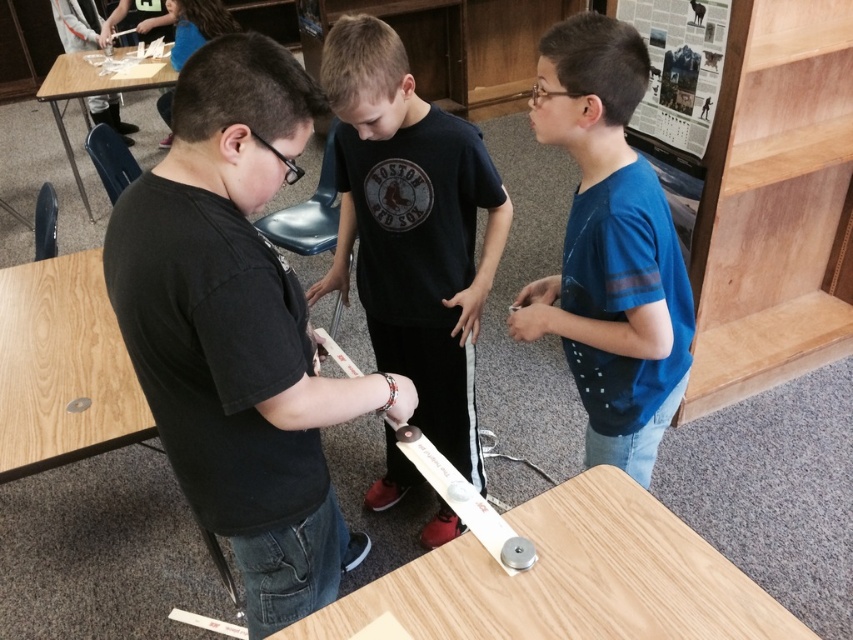
Can you confirm if black cotton shirt at center is positioned below wooden table at upper left?

Indeed, black cotton shirt at center is positioned under wooden table at upper left.

How distant is black cotton shirt at center from wooden table at upper left?

They are 2.69 meters apart.

I want to click on black cotton shirt at center, so click(x=412, y=228).

Who is lower down, blue cotton shirt at center or wooden table at upper left?

Positioned lower is blue cotton shirt at center.

Is blue cotton shirt at center smaller than wooden table at upper left?

Indeed, blue cotton shirt at center has a smaller size compared to wooden table at upper left.

Describe the element at coordinates (608, 248) in the screenshot. The width and height of the screenshot is (853, 640). I see `blue cotton shirt at center` at that location.

The height and width of the screenshot is (640, 853). I want to click on blue cotton shirt at center, so click(x=608, y=248).

Between light brown wood table at center and light brown wood table at lower left, which one is positioned lower?

Positioned lower is light brown wood table at center.

Is light brown wood table at center wider than light brown wood table at lower left?

Indeed, light brown wood table at center has a greater width compared to light brown wood table at lower left.

Who is more distant from viewer, (462,604) or (9,289)?

Point (9,289)

This screenshot has width=853, height=640. In order to click on light brown wood table at center in this screenshot , I will do `click(570, 579)`.